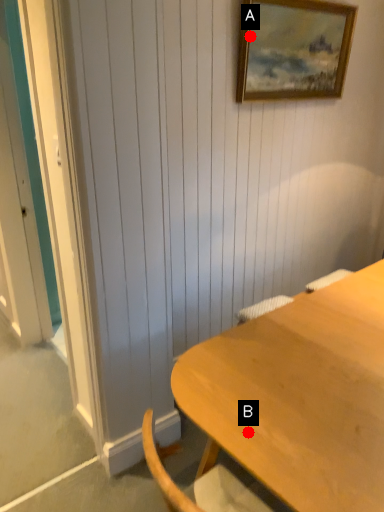
Question: Two points are circled on the image, labeled by A and B beside each circle. Which of the following is the farthest from the observer?

Choices:
 (A) A is further
 (B) B is further

Answer: (A)